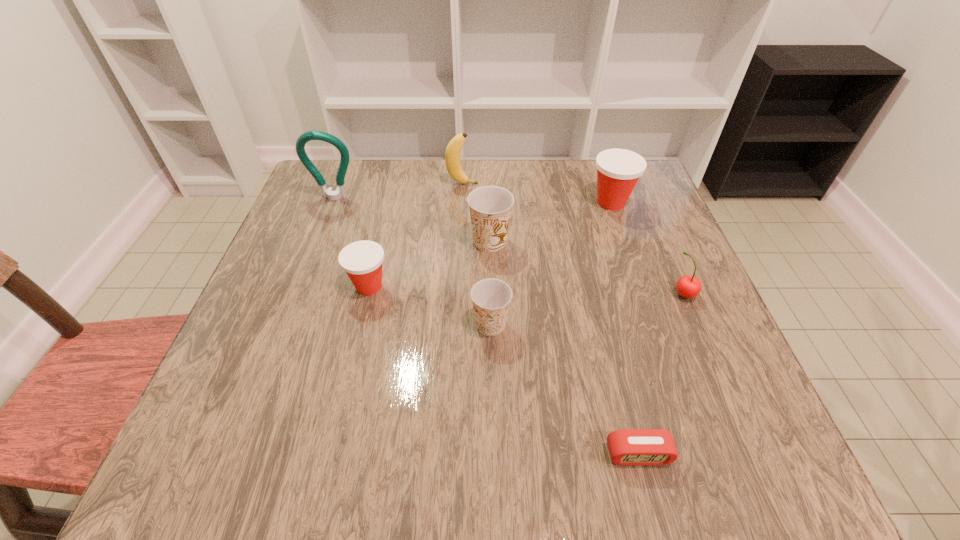
Locate an element on the screen. vacant region that satisfies the following two spatial constraints: 1. from the stem of the banana; 2. at the jaws of the green bottle opener is located at coordinates (462, 198).

Locate an element on the screen. vacant space that satisfies the following two spatial constraints: 1. at the jaws of the green bottle opener; 2. on the left side of the nearest Dixie cup is located at coordinates (285, 325).

Where is `vacant area in the image that satisfies the following two spatial constraints: 1. at the jaws of the nearer red-orange Dixie cup; 2. on the right side of the green bottle opener`? vacant area in the image that satisfies the following two spatial constraints: 1. at the jaws of the nearer red-orange Dixie cup; 2. on the right side of the green bottle opener is located at coordinates (300, 286).

Where is `vacant space that satisfies the following two spatial constraints: 1. at the jaws of the red cherry; 2. on the right side of the tallest object`? Image resolution: width=960 pixels, height=540 pixels. vacant space that satisfies the following two spatial constraints: 1. at the jaws of the red cherry; 2. on the right side of the tallest object is located at coordinates (298, 294).

Image resolution: width=960 pixels, height=540 pixels. I want to click on vacant area that satisfies the following two spatial constraints: 1. at the jaws of the nearer red-orange Dixie cup; 2. on the right side of the leftmost object, so click(x=300, y=286).